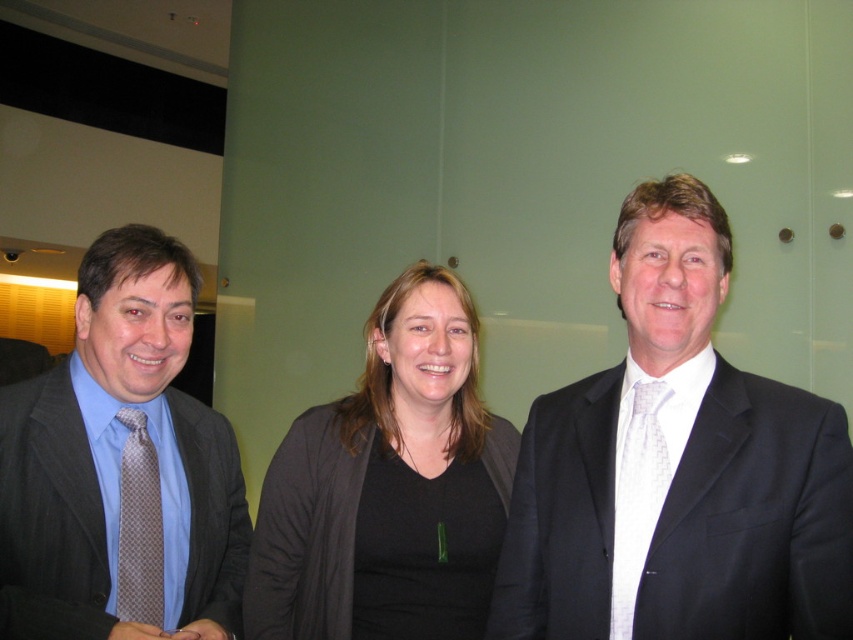
Question: Which object is farther from the camera taking this photo?

Choices:
 (A) brown dotted tie at left
 (B) matte brown suit at left

Answer: (A)

Question: Which point is farther to the camera?

Choices:
 (A) (250, 577)
 (B) (119, 534)
 (C) (619, 442)
 (D) (35, 554)

Answer: (A)

Question: Is dark gray suit at right further to camera compared to white textured tie at right?

Choices:
 (A) no
 (B) yes

Answer: (A)

Question: Does black matte cardigan at center appear on the right side of white textured tie at right?

Choices:
 (A) yes
 (B) no

Answer: (B)

Question: Which of these objects is positioned farthest from the matte brown suit at left?

Choices:
 (A) black matte cardigan at center
 (B) dark gray suit at right
 (C) white textured tie at right

Answer: (C)

Question: Can you confirm if black matte cardigan at center is thinner than white textured tie at right?

Choices:
 (A) yes
 (B) no

Answer: (B)